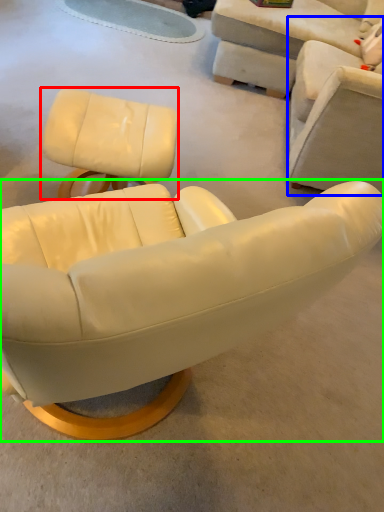
Question: Which object is positioned closest to chair (highlighted by a red box)? Select from chair (highlighted by a blue box) and chair (highlighted by a green box).

Choices:
 (A) chair
 (B) chair

Answer: (A)